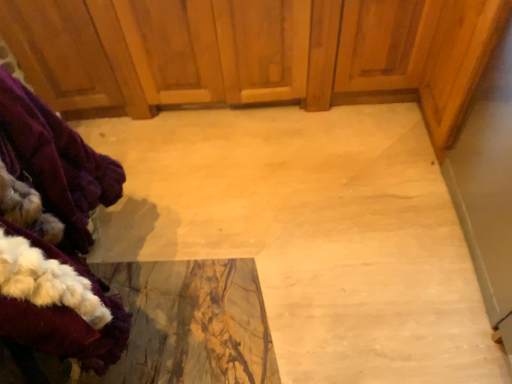
Question: Is velvety purple coat at left with wooden dresser at center?

Choices:
 (A) yes
 (B) no

Answer: (B)

Question: Does velvety purple coat at left have a lesser height compared to wooden dresser at center?

Choices:
 (A) yes
 (B) no

Answer: (B)

Question: From a real-world perspective, does velvety purple coat at left stand above wooden dresser at center?

Choices:
 (A) no
 (B) yes

Answer: (B)

Question: Is wooden dresser at center completely or partially inside velvety purple coat at left?

Choices:
 (A) yes
 (B) no

Answer: (B)

Question: From the image's perspective, does velvety purple coat at left appear lower than wooden dresser at center?

Choices:
 (A) no
 (B) yes

Answer: (B)

Question: Does velvety purple coat at left have a greater height compared to wooden dresser at center?

Choices:
 (A) yes
 (B) no

Answer: (A)

Question: Would you say velvety purple coat at left is part of wooden dresser at center's contents?

Choices:
 (A) no
 (B) yes

Answer: (A)

Question: Is wooden dresser at center smaller than velvety purple coat at left?

Choices:
 (A) yes
 (B) no

Answer: (B)

Question: Is wooden dresser at center behind velvety purple coat at left?

Choices:
 (A) yes
 (B) no

Answer: (A)

Question: Does wooden dresser at center appear on the left side of velvety purple coat at left?

Choices:
 (A) no
 (B) yes

Answer: (A)

Question: Can you confirm if wooden dresser at center is taller than velvety purple coat at left?

Choices:
 (A) no
 (B) yes

Answer: (A)

Question: Does wooden dresser at center come in front of velvety purple coat at left?

Choices:
 (A) no
 (B) yes

Answer: (A)

Question: Considering the positions of velvety purple coat at left and wooden dresser at center in the image, is velvety purple coat at left taller or shorter than wooden dresser at center?

Choices:
 (A) tall
 (B) short

Answer: (A)